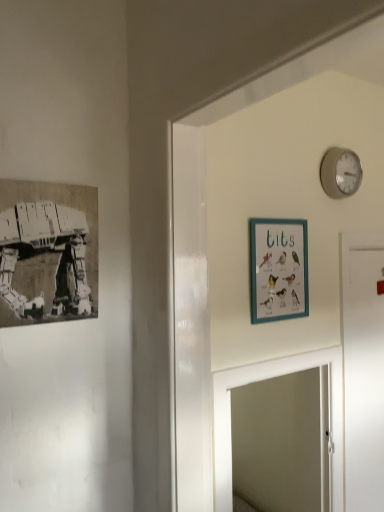
Question: Does black paper print at left, which is the 2th picture frame in back-to-front order, have a lesser width compared to white matte door at right?

Choices:
 (A) no
 (B) yes

Answer: (B)

Question: Considering the relative sizes of black paper print at left, acting as the 1th picture frame starting from the left, and white matte door at right in the image provided, is black paper print at left, acting as the 1th picture frame starting from the left, smaller than white matte door at right?

Choices:
 (A) no
 (B) yes

Answer: (B)

Question: From the image's perspective, is black paper print at left, the second picture frame positioned from the right, on white matte door at right?

Choices:
 (A) yes
 (B) no

Answer: (A)

Question: Is black paper print at left, which is the 2th picture frame in back-to-front order, shorter than white matte door at right?

Choices:
 (A) no
 (B) yes

Answer: (B)

Question: Considering their positions, is white matte door at right located in front of or behind teal wooden picture frame at upper center, marked as the first picture frame in a right-to-left arrangement?

Choices:
 (A) behind
 (B) front

Answer: (A)

Question: From a real-world perspective, relative to teal wooden picture frame at upper center, acting as the 1th picture frame starting from the back, is white matte door at right vertically above or below?

Choices:
 (A) above
 (B) below

Answer: (B)

Question: Would you say white matte door at right is inside or outside teal wooden picture frame at upper center, marked as the first picture frame in a right-to-left arrangement?

Choices:
 (A) outside
 (B) inside

Answer: (A)

Question: From the image's perspective, is white matte door at right above or below teal wooden picture frame at upper center, marked as the first picture frame in a right-to-left arrangement?

Choices:
 (A) above
 (B) below

Answer: (B)

Question: From a real-world perspective, is teal wooden picture frame at upper center, which is counted as the second picture frame, starting from the front, positioned above or below white glossy mirror at center?

Choices:
 (A) above
 (B) below

Answer: (A)

Question: Is teal wooden picture frame at upper center, which is counted as the second picture frame, starting from the front, in front of or behind white glossy mirror at center in the image?

Choices:
 (A) behind
 (B) front

Answer: (A)

Question: Is point (292, 237) closer or farther from the camera than point (336, 381)?

Choices:
 (A) farther
 (B) closer

Answer: (B)

Question: In terms of height, does teal wooden picture frame at upper center, marked as the first picture frame in a right-to-left arrangement, look taller or shorter compared to white glossy mirror at center?

Choices:
 (A) short
 (B) tall

Answer: (A)

Question: Relative to white matte door at right, is black paper print at left, which is the 2th picture frame in back-to-front order, in front or behind?

Choices:
 (A) behind
 (B) front

Answer: (B)

Question: Looking at the image, does black paper print at left, which is the 2th picture frame in back-to-front order, seem bigger or smaller compared to white matte door at right?

Choices:
 (A) small
 (B) big

Answer: (A)